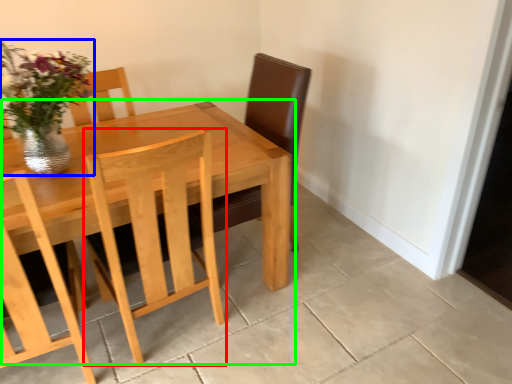
Question: Estimate the real-world distances between objects in this image. Which object is closer to chair (highlighted by a red box), floral arrangement (highlighted by a blue box) or kitchen & dining room table (highlighted by a green box)?

Choices:
 (A) floral arrangement
 (B) kitchen & dining room table

Answer: (B)